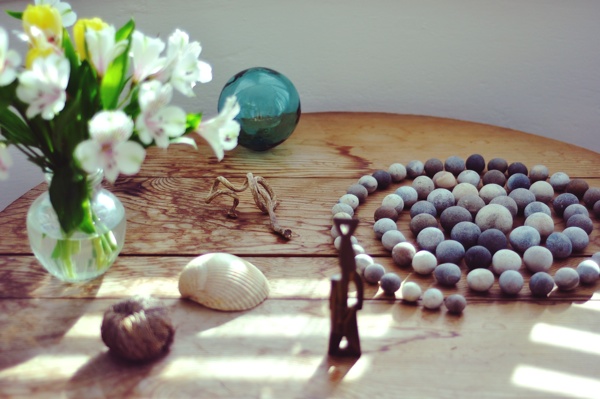
Identify the location of wooden table slats. This screenshot has width=600, height=399. (288, 345), (306, 278), (315, 221), (348, 150).